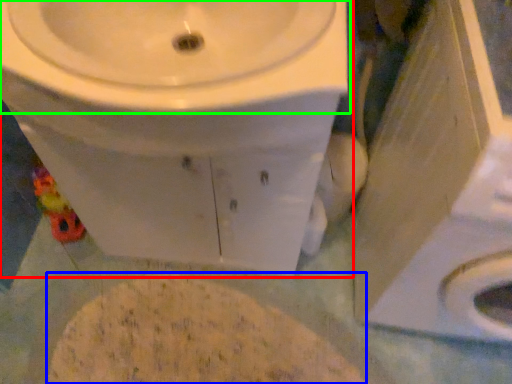
Question: Which object is the farthest from toilet (highlighted by a red box)? Choose among these: flour (highlighted by a blue box) or sink (highlighted by a green box).

Choices:
 (A) flour
 (B) sink

Answer: (A)